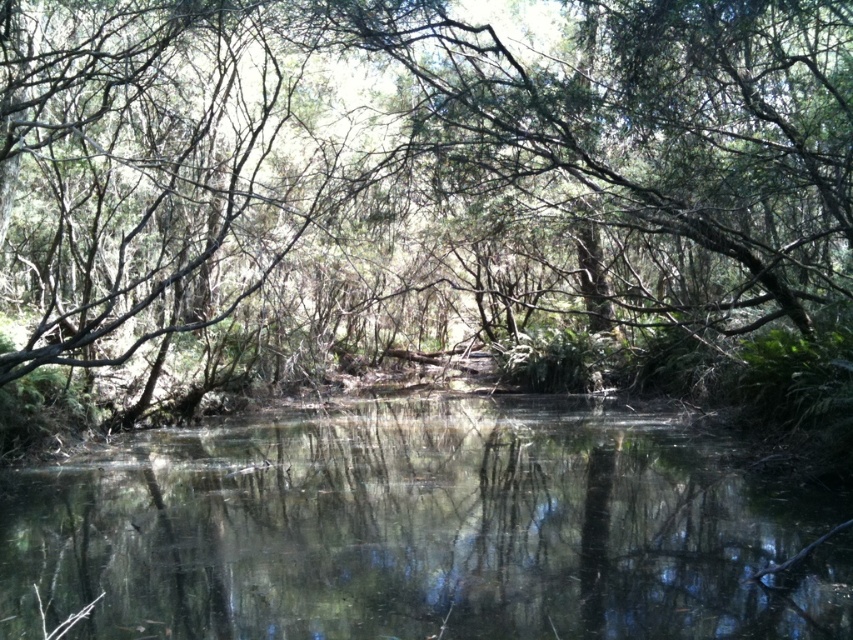
You are a photographer trying to capture the reflection of the green leafy tree at center in the clear water at center. Based on their widths, which object would appear wider in the photo?

The green leafy tree at center would appear wider in the photo because its width surpasses that of the clear water at center according to the description.

You are standing at the edge of the water in the scene and want to walk towards the two points marked in the image. Which point, point (715, 278) or point (448, 604), will you reach first?

You will reach point (715, 278) first because it is closer to you than point (448, 604), which is further away.